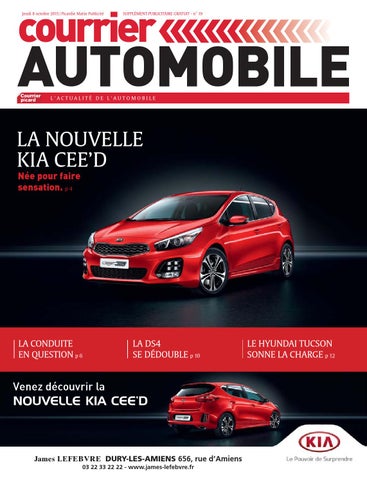
Where is `back window`? Image resolution: width=367 pixels, height=480 pixels. back window is located at coordinates (188, 391).